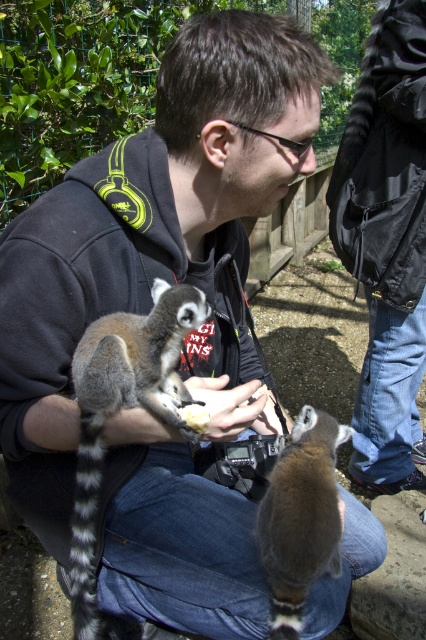
You are a park ranger trying to locate two specific points in the image. The first point is at coordinate point (365,161) and the second is at point (72,616). From the perspective of someone standing at the second point, which direction would the first point be located?

The point (365,161) is behind point (72,616), so from the perspective of someone standing at the second point, the first point would be located behind them.